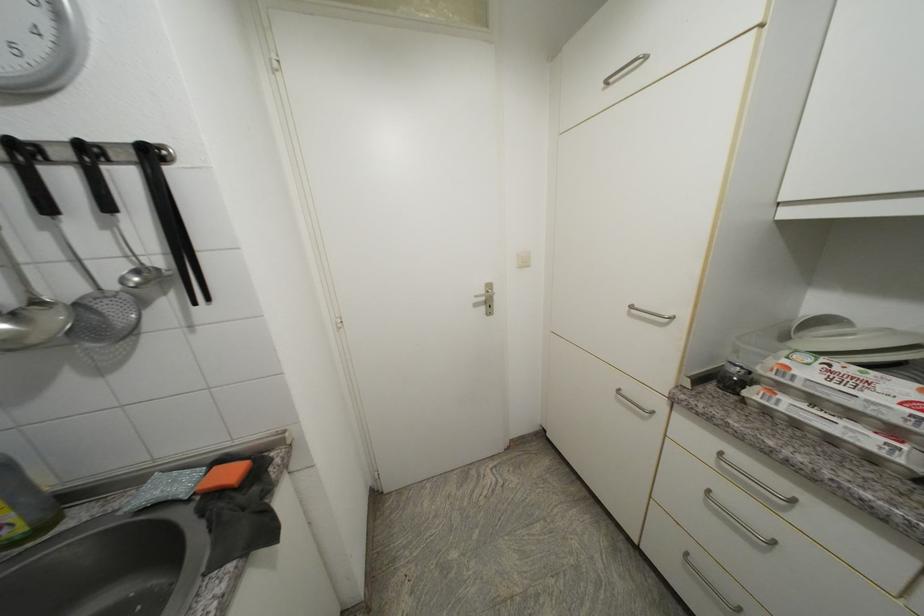
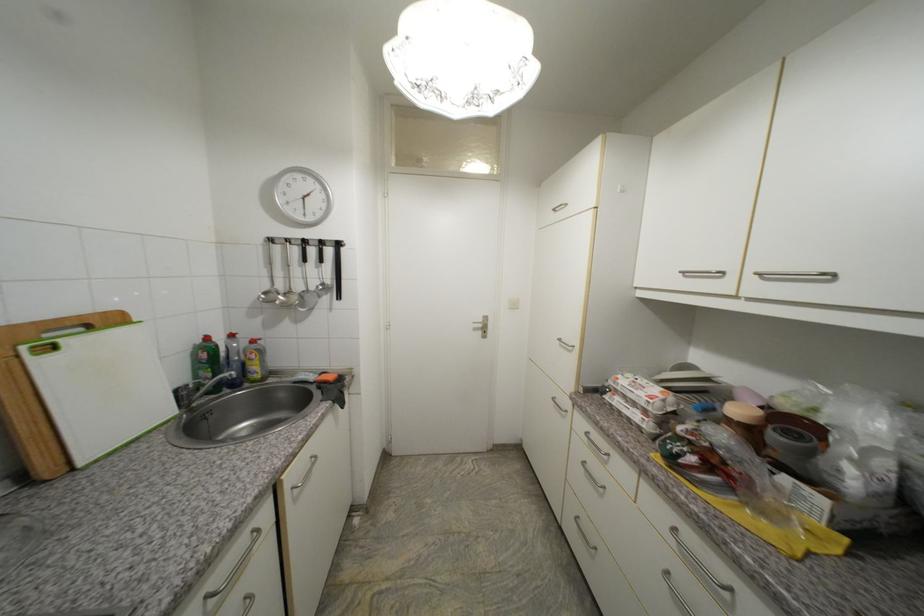
Which direction would the cameraman need to move to produce the second image?

The movement direction of the cameraman is right, backward.